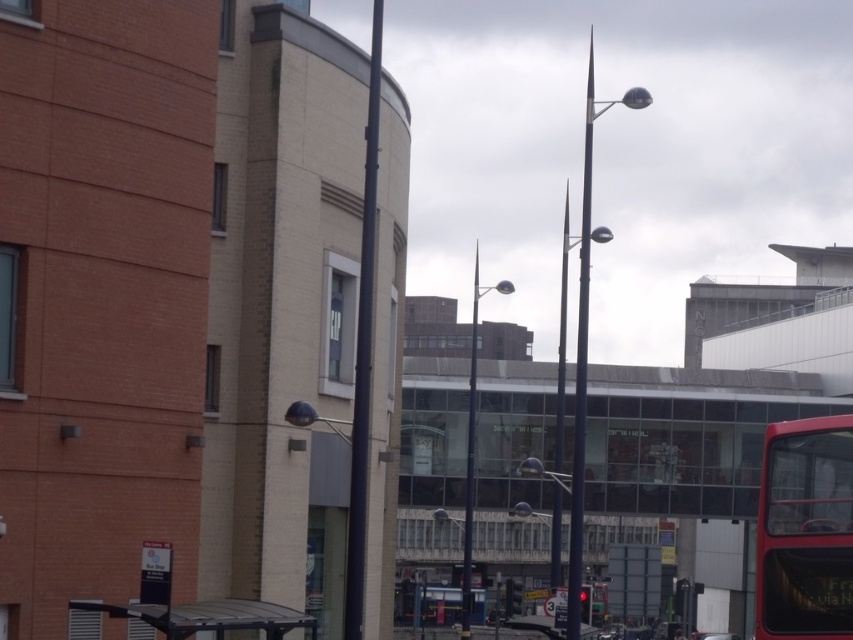
Based on the photo, you are a city planner assessing the layout of this urban area. You need to determine if the red matte bus at right can fully park at the metallic gray bus stop at lower left without overhanging. Based on their sizes, what is your assessment?

The red matte bus at right is larger in size than the metallic gray bus stop at lower left, so it cannot fully park there without overhanging.

You are standing on the sidewalk in the urban scene and want to cross the street to reach the curved, light colored building. There is a red matte bus at right blocking your path. Can you safely walk around the bus to get to the building?

The red matte bus at right is 12.99 meters away from viewer, so you can safely walk around it to reach the curved, light colored building.